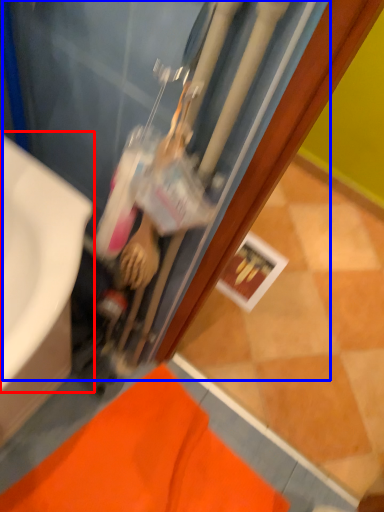
Question: Among these objects, which one is farthest to the camera, sink (highlighted by a red box) or water heater (highlighted by a blue box)?

Choices:
 (A) sink
 (B) water heater

Answer: (A)